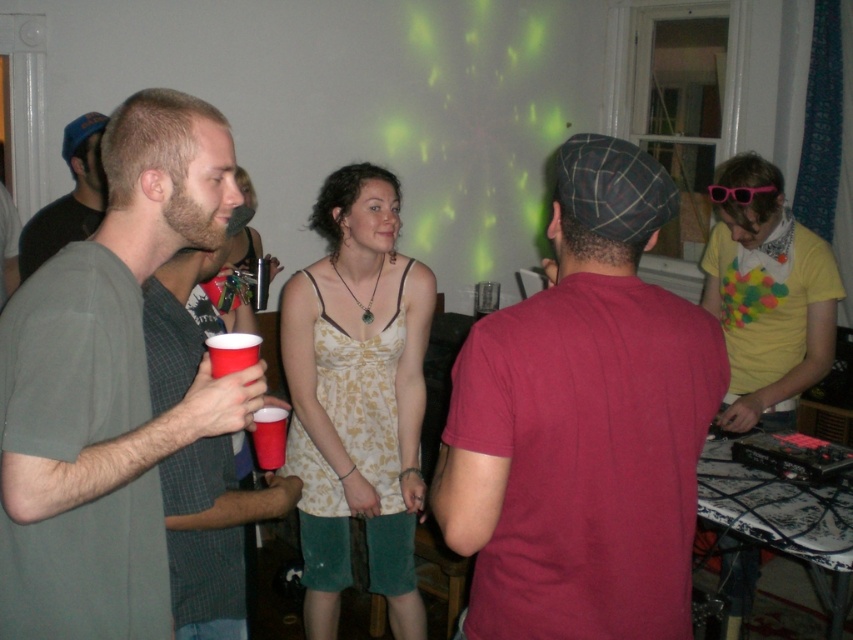
Who is more forward, (86, 269) or (32, 250)?

Positioned in front is point (86, 269).

Which is more to the left, matte green t-shirt at left or matte gray shirt at left?

matte gray shirt at left is more to the left.

Between point (28, 429) and point (79, 220), which one is positioned behind?

Point (79, 220)

Identify the location of matte green t-shirt at left. (108, 387).

Does point (606, 326) come in front of point (747, 554)?

Yes, point (606, 326) is closer to viewer.

Between point (581, 352) and point (727, 428), which one is positioned in front?

Point (581, 352) is in front.

You are a GUI agent. You are given a task and a screenshot of the screen. Output one action in this format:
    pyautogui.click(x=<x>, y=<y>)
    Task: Click on the matte red t-shirt at center
    This screenshot has height=640, width=853.
    Given the screenshot: What is the action you would take?
    pyautogui.click(x=583, y=422)

Is yellow matte shirt at right behind matte plastic cup at left?

Yes, it is behind matte plastic cup at left.

Is yellow matte shirt at right wider than matte plastic cup at left?

Yes, yellow matte shirt at right is wider than matte plastic cup at left.

Who is more distant from viewer, (722,413) or (244,355)?

Positioned behind is point (722,413).

The image size is (853, 640). Identify the location of yellow matte shirt at right. (767, 300).